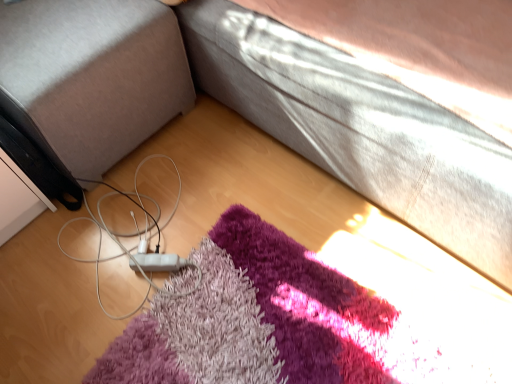
Find the location of a particular element. The image size is (512, 384). matte black speaker at lower left is located at coordinates (91, 77).

The image size is (512, 384). What do you see at coordinates (91, 77) in the screenshot? I see `matte black speaker at lower left` at bounding box center [91, 77].

Describe the element at coordinates (139, 243) in the screenshot. I see `white matte cable at lower left` at that location.

Identify the location of white matte cable at lower left. (139, 243).

The image size is (512, 384). Find the location of `matte black speaker at lower left`. matte black speaker at lower left is located at coordinates (91, 77).

Considering the positions of objects white matte cable at lower left and matte black speaker at lower left in the image provided, who is more to the right, white matte cable at lower left or matte black speaker at lower left?

white matte cable at lower left.

Based on the photo, does white matte cable at lower left come in front of matte black speaker at lower left?

No, the depth of white matte cable at lower left is greater than that of matte black speaker at lower left.

Does point (105, 314) come behind point (135, 37)?

Yes, point (105, 314) is farther from viewer.

From the image's perspective, relative to matte black speaker at lower left, is white matte cable at lower left above or below?

white matte cable at lower left is below matte black speaker at lower left.

From a real-world perspective, is white matte cable at lower left located beneath matte black speaker at lower left?

Yes.

Is white matte cable at lower left wider than matte black speaker at lower left?

Incorrect, the width of white matte cable at lower left does not surpass that of matte black speaker at lower left.

Between white matte cable at lower left and matte black speaker at lower left, which one has more height?

matte black speaker at lower left is taller.

Consider the image. Based on their sizes in the image, would you say white matte cable at lower left is bigger or smaller than matte black speaker at lower left?

Considering their sizes, white matte cable at lower left takes up less space than matte black speaker at lower left.

Is white matte cable at lower left positioned beyond the bounds of matte black speaker at lower left?

That's correct, white matte cable at lower left is outside of matte black speaker at lower left.

Is white matte cable at lower left touching matte black speaker at lower left?

white matte cable at lower left is not next to matte black speaker at lower left, and they're not touching.

Is white matte cable at lower left oriented towards matte black speaker at lower left?

No, white matte cable at lower left is not turned towards matte black speaker at lower left.

How distant is white matte cable at lower left from matte black speaker at lower left?

12.54 inches.

Identify the location of gray above the white matte cable at lower left (from the image's perspective). (91, 77).

In the image, is matte black speaker at lower left on the left side or the right side of white matte cable at lower left?

From the image, it's evident that matte black speaker at lower left is to the left of white matte cable at lower left.

Between matte black speaker at lower left and white matte cable at lower left, which one is positioned in front?

Positioned in front is matte black speaker at lower left.

Is point (96, 13) positioned in front of point (172, 259)?

That is True.

Consider the image. From the image's perspective, which is above, matte black speaker at lower left or white matte cable at lower left?

matte black speaker at lower left, from the image's perspective.

From a real-world perspective, is matte black speaker at lower left located beneath white matte cable at lower left?

No.

Does matte black speaker at lower left have a lesser width compared to white matte cable at lower left?

No.

Is matte black speaker at lower left shorter than white matte cable at lower left?

No, matte black speaker at lower left is not shorter than white matte cable at lower left.

Can you confirm if matte black speaker at lower left is smaller than white matte cable at lower left?

→ No, matte black speaker at lower left is not smaller than white matte cable at lower left.

Is matte black speaker at lower left not within white matte cable at lower left?

Yes, matte black speaker at lower left is outside of white matte cable at lower left.

Are matte black speaker at lower left and white matte cable at lower left far apart?

That's not correct — matte black speaker at lower left is a little close to white matte cable at lower left.

In the scene shown: Is matte black speaker at lower left facing towards white matte cable at lower left?

Yes, matte black speaker at lower left faces towards white matte cable at lower left.

How many degrees apart are the facing directions of matte black speaker at lower left and white matte cable at lower left?

They differ by 49.4 degrees in their facing directions.

The image size is (512, 384). Find the location of `cable behind the matte black speaker at lower left`. cable behind the matte black speaker at lower left is located at coordinates (139, 243).

Locate an element on the screen. gray that appears in front of the white matte cable at lower left is located at coordinates (91, 77).

Where is `cable below the matte black speaker at lower left (from a real-world perspective)`? The width and height of the screenshot is (512, 384). cable below the matte black speaker at lower left (from a real-world perspective) is located at coordinates (139, 243).